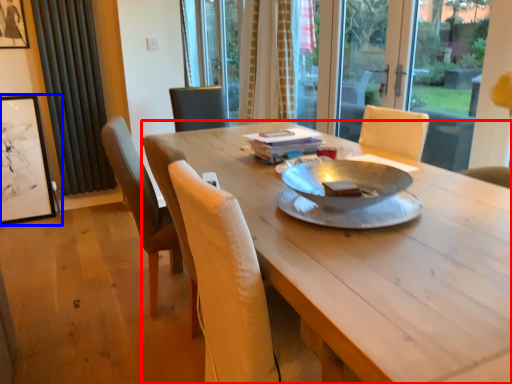
Question: Which object appears closest to the camera in this image, desk (highlighted by a red box) or picture frame (highlighted by a blue box)?

Choices:
 (A) desk
 (B) picture frame

Answer: (A)